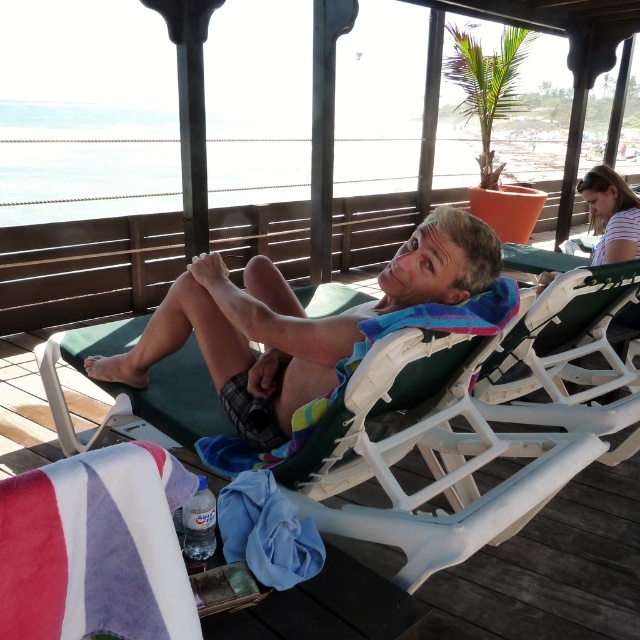
Question: Which point appears closest to the camera in this image?

Choices:
 (A) (314, 360)
 (B) (262, 508)
 (C) (76, 570)

Answer: (C)

Question: Is velvet-like beach towel at lower left smaller than blue fabric towel at lower center?

Choices:
 (A) yes
 (B) no

Answer: (B)

Question: Which point is farther to the camera?

Choices:
 (A) velvet-like beach towel at lower left
 (B) green plastic chair at center
 (C) plaid shorts at center

Answer: (C)

Question: Which of these objects is positioned farthest from the velvet-like beach towel at lower left?

Choices:
 (A) plaid shorts at center
 (B) blue fabric towel at lower center
 (C) green plastic chair at center

Answer: (C)

Question: Observing the image, what is the correct spatial positioning of plaid shorts at center in reference to velvet-like beach towel at lower left?

Choices:
 (A) left
 (B) right

Answer: (B)

Question: Can you confirm if plaid shorts at center is positioned to the right of blue fabric towel at lower center?

Choices:
 (A) no
 (B) yes

Answer: (A)